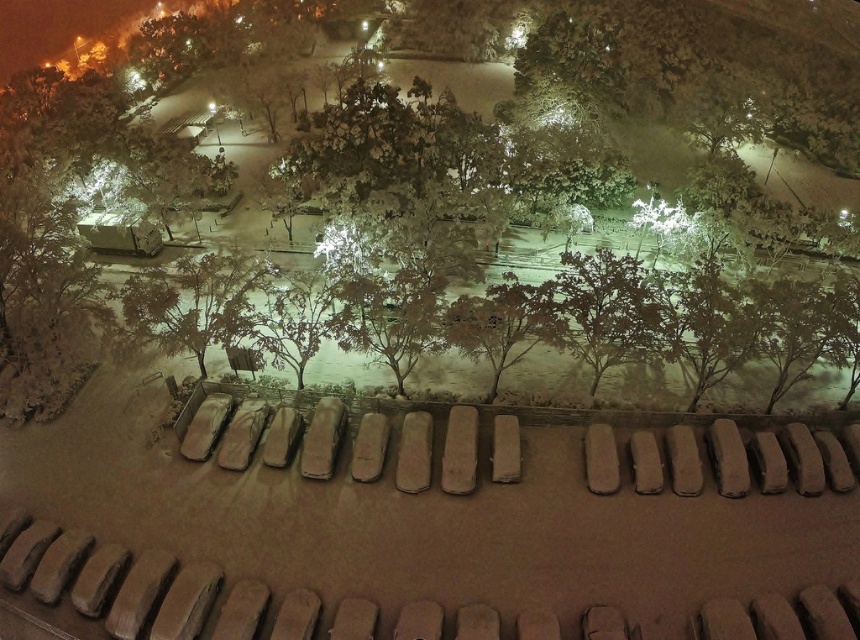
Question: Which of the following is the closest to the observer?

Choices:
 (A) green matte tree at center
 (B) snowy bark tree at center

Answer: (B)

Question: Which point appears closest to the camera in this image?

Choices:
 (A) (231, 253)
 (B) (493, 365)

Answer: (B)

Question: Can you confirm if green matte tree at center is positioned to the right of snowy bark tree at center?

Choices:
 (A) yes
 (B) no

Answer: (B)

Question: Can you confirm if green matte tree at center is positioned to the left of snowy bark tree at center?

Choices:
 (A) yes
 (B) no

Answer: (A)

Question: Is green matte tree at center below snowy bark tree at center?

Choices:
 (A) no
 (B) yes

Answer: (A)